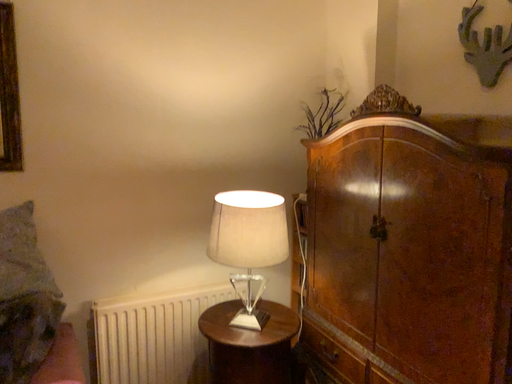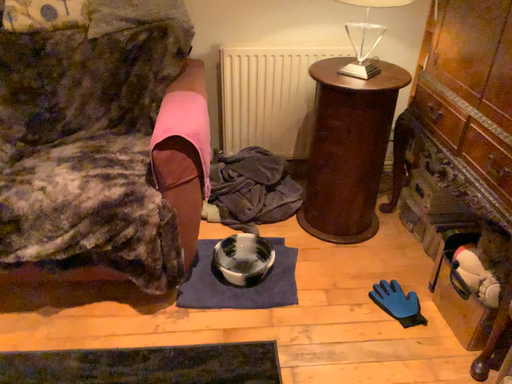
Question: Which way did the camera rotate in the video?

Choices:
 (A) rotated left
 (B) rotated right

Answer: (A)